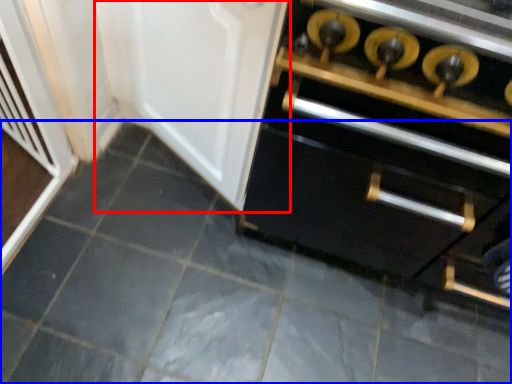
Question: Which of the following is the farthest to the observer, door (highlighted by a red box) or ceramic tile (highlighted by a blue box)?

Choices:
 (A) door
 (B) ceramic tile

Answer: (B)